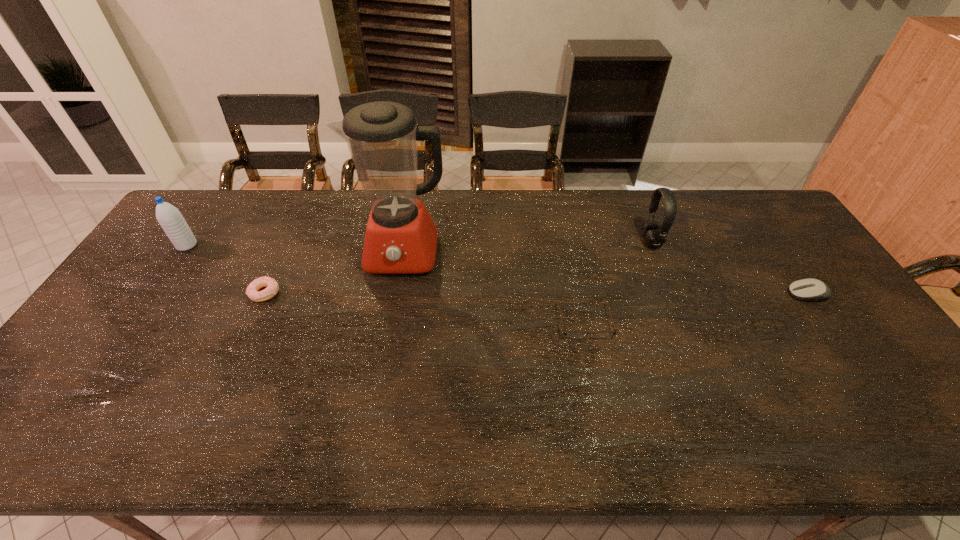
Find the location of a particular element. object situated at the left edge is located at coordinates (169, 217).

Find the location of a particular element. object that is at the right edge is located at coordinates (806, 289).

Locate an element on the screen. vacant area at the far edge is located at coordinates (466, 220).

In the image, there is a desktop. Find the location of `vacant region at the left edge`. vacant region at the left edge is located at coordinates (200, 234).

Identify the location of vacant space at the right edge. 787,300.

Where is `vacant space at the far left corner of the desktop`? The width and height of the screenshot is (960, 540). vacant space at the far left corner of the desktop is located at coordinates (205, 202).

This screenshot has width=960, height=540. I want to click on vacant space that is in between the fourth object from left to right and the doughnut, so click(x=424, y=307).

The image size is (960, 540). I want to click on vacant space that is in between the spectacles and the headset, so click(617, 281).

Where is `free space between the tallest object and the leftmost object`? free space between the tallest object and the leftmost object is located at coordinates (296, 249).

This screenshot has width=960, height=540. In order to click on free space between the doughnut and the spectacles in this screenshot , I will do `click(424, 307)`.